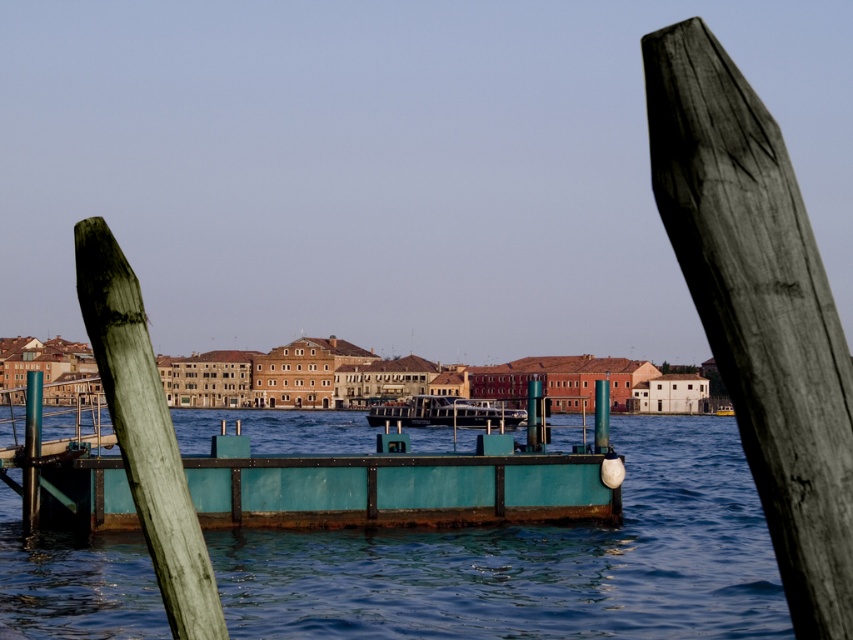
Question: Does shiny black boat at center come behind green painted metal post at center?

Choices:
 (A) yes
 (B) no

Answer: (A)

Question: Which point is farther to the camera?

Choices:
 (A) shiny black boat at center
 (B) metallic green post at center
 (C) teal painted wood dock at center

Answer: (B)

Question: Can you confirm if shiny black boat at center is positioned to the right of green painted metal post at center?

Choices:
 (A) yes
 (B) no

Answer: (B)

Question: Is teal metallic water at center smaller than teal painted wood post at left?

Choices:
 (A) yes
 (B) no

Answer: (B)

Question: Which point is closer to the camera taking this photo?

Choices:
 (A) (529, 385)
 (B) (598, 403)
 (C) (209, 496)
 (D) (39, 444)

Answer: (C)

Question: Which point appears closest to the camera in this image?

Choices:
 (A) (32, 404)
 (B) (602, 404)
 (C) (173, 589)

Answer: (C)